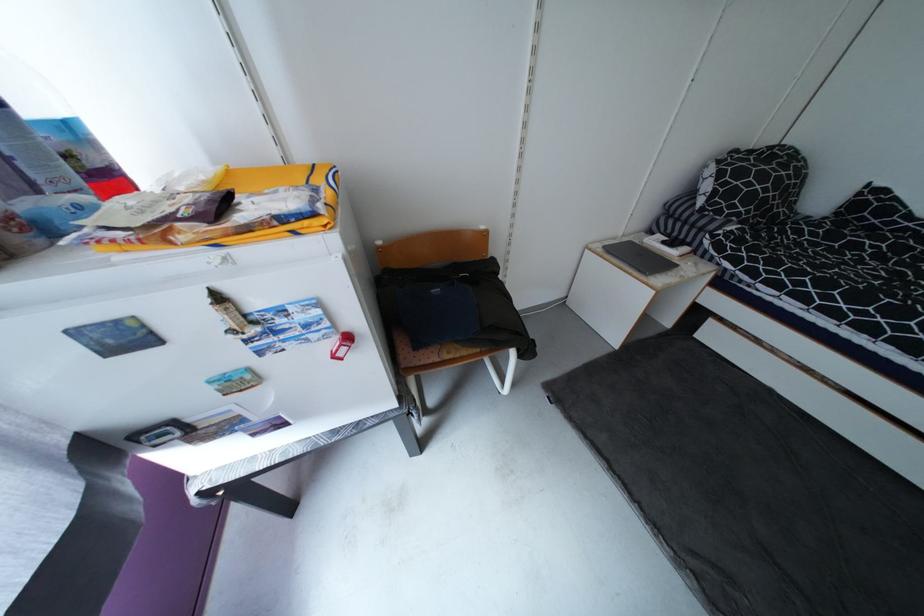
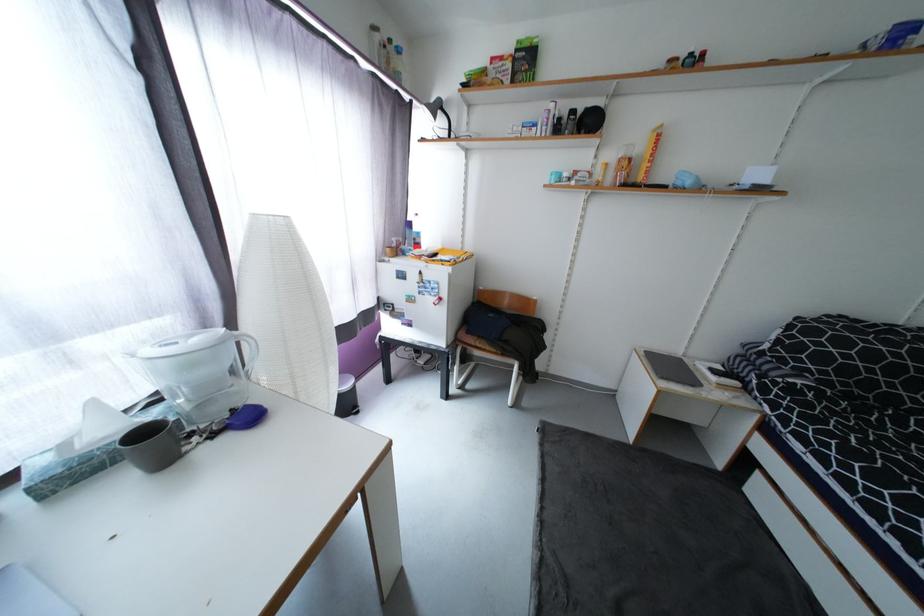
The point at (610, 249) is marked in the first image. Where is the corresponding point in the second image?

(650, 353)